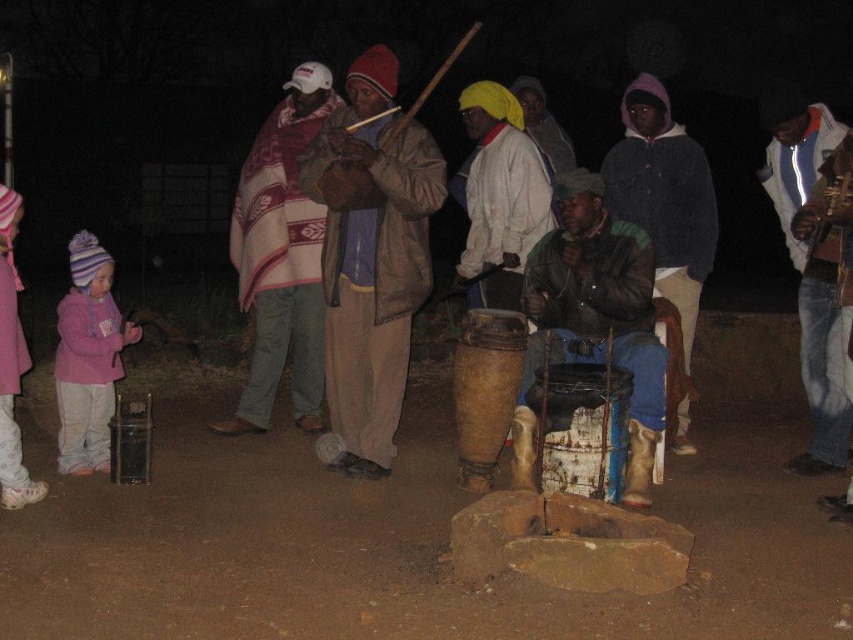
Does brown leather bag at center have a lesser height compared to dark blue jacket at center?

Incorrect, brown leather bag at center's height does not fall short of dark blue jacket at center's.

Is brown leather bag at center wider than dark blue jacket at center?

Correct, the width of brown leather bag at center exceeds that of dark blue jacket at center.

Does point (405, 339) come behind point (682, 336)?

No.

The image size is (853, 640). In order to click on brown leather bag at center in this screenshot , I will do `click(370, 256)`.

Is dark blue jacket at center to the right of white and blue jacket at right from the viewer's perspective?

Incorrect, dark blue jacket at center is not on the right side of white and blue jacket at right.

Is point (672, 268) farther from camera compared to point (822, 472)?

Yes, it is.

The height and width of the screenshot is (640, 853). Identify the location of dark blue jacket at center. (664, 196).

Between white and blue jacket at right and matte brown drum at center, which one has more height?

With more height is matte brown drum at center.

Is point (786, 88) farther from viewer compared to point (461, 262)?

No, it is in front of (461, 262).

Is point (776, 145) positioned in front of point (483, 262)?

Yes, point (776, 145) is closer to viewer.

This screenshot has height=640, width=853. In order to click on white and blue jacket at right in this screenshot , I will do `click(808, 266)`.